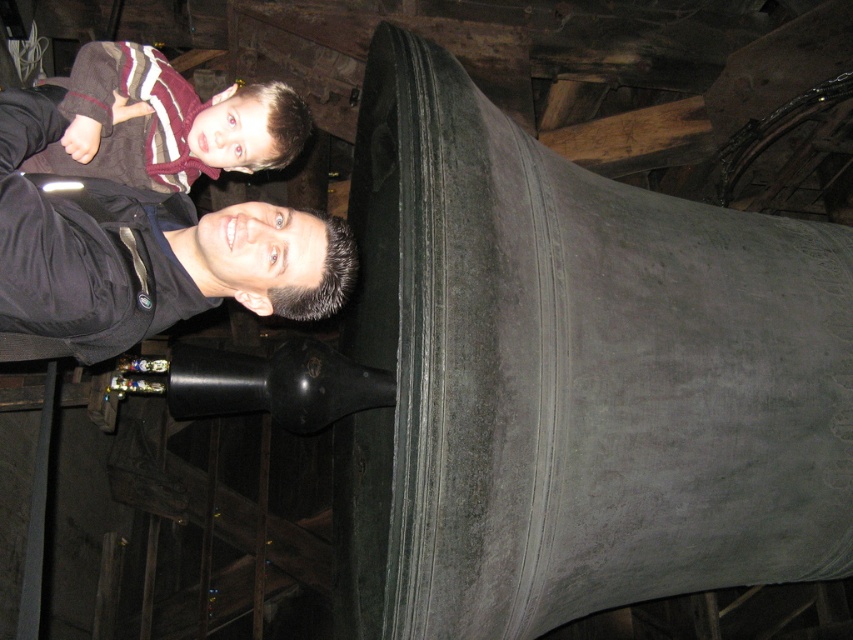
Consider the image. Can you confirm if matte black jacket at lower left is positioned below matte black shirt at upper left?

Indeed, matte black jacket at lower left is positioned under matte black shirt at upper left.

Who is shorter, matte black jacket at lower left or matte black shirt at upper left?

matte black shirt at upper left

Does point (80, 291) come in front of point (189, 140)?

Yes.

Locate an element on the screen. The height and width of the screenshot is (640, 853). matte black jacket at lower left is located at coordinates coord(143,250).